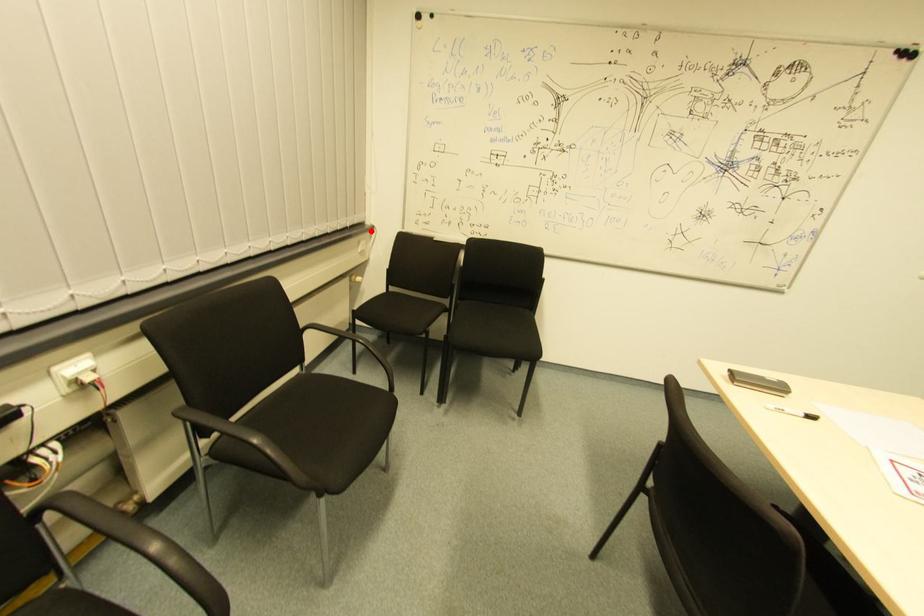
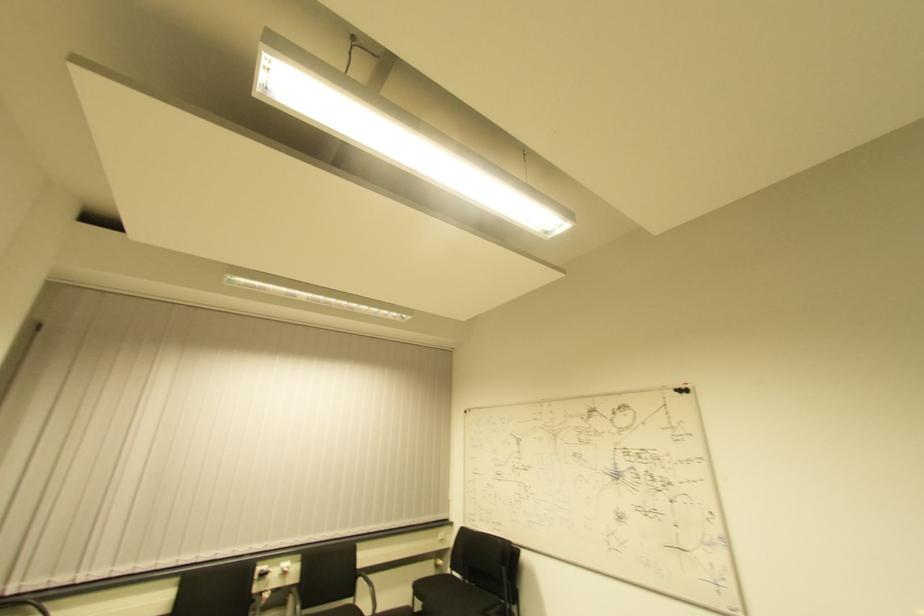
Question: I am providing you with two images of the same scene from different viewpoints. In image1, a red point is highlighted. Considering the same 3D point in image2, which of the following is correct?

Choices:
 (A) It is closer
 (B) It is farther

Answer: (B)